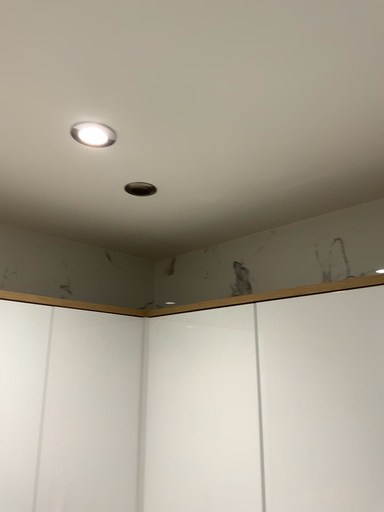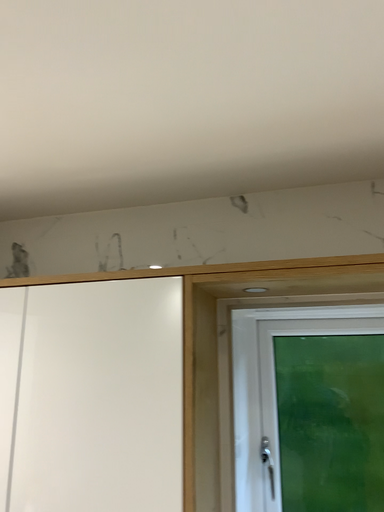
Question: Which way did the camera rotate in the video?

Choices:
 (A) rotated right
 (B) rotated left

Answer: (A)